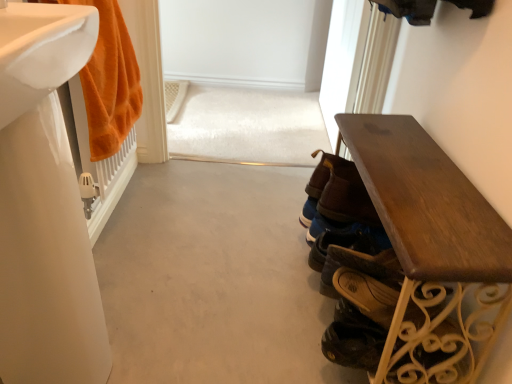
How much space does brown leather shoe at lower right, which is counted as the 1th shoe, starting from the top, occupy horizontally?

It is 18.76 centimeters.

Looking at this image, what is the approximate height of brown leather shoe at lower right, which is counted as the 1th shoe, starting from the top?

The height of brown leather shoe at lower right, which is counted as the 1th shoe, starting from the top, is 1.58 inches.

At what (x,y) coordinates should I click in order to perform the action: click on white glossy sink at left, which is the first sink in bottom-to-top order. Please return your answer as a coordinate pair (x, y). Looking at the image, I should click on (45, 205).

This screenshot has width=512, height=384. I want to click on shiny black shoe at lower right, which is counted as the second shoe, starting from the top, so click(354, 344).

Find the location of a particular element. The height and width of the screenshot is (384, 512). wooden bench at right is located at coordinates [433, 252].

Where is `brown leather shoe at lower right, marked as the second footwear in a back-to-front arrangement`? This screenshot has height=384, width=512. brown leather shoe at lower right, marked as the second footwear in a back-to-front arrangement is located at coordinates (360, 267).

Find the location of a particular element. white glossy sink at left, the 2th sink when ordered from bottom to top is located at coordinates (41, 52).

What is the approximate width of white glossy sink at left, the 2th sink when ordered from bottom to top?

8.75 inches.

At what (x,y) coordinates should I click in order to perform the action: click on brown leather shoe at lower right, which is counted as the 1th shoe, starting from the top. Please return your answer as a coordinate pair (x, y). Looking at the image, I should click on (367, 294).

How many degrees apart are the facing directions of shiny black shoe at lower right, which is counted as the second shoe, starting from the top, and white glossy sink at left, which is the second sink from top to bottom?

The angular difference between shiny black shoe at lower right, which is counted as the second shoe, starting from the top, and white glossy sink at left, which is the second sink from top to bottom, is 178 degrees.

Which point is more distant from viewer, (342, 356) or (61, 36)?

Point (342, 356)

Looking at their sizes, would you say shiny black shoe at lower right, which is counted as the second shoe, starting from the top, is wider or thinner than white glossy sink at left, which is the first sink in bottom-to-top order?

shiny black shoe at lower right, which is counted as the second shoe, starting from the top, is wider than white glossy sink at left, which is the first sink in bottom-to-top order.

Is shiny black shoe at lower right, which is counted as the second shoe, starting from the top, spatially inside white glossy sink at left, which is the first sink in bottom-to-top order, or outside of it?

The correct answer is: outside.

Is brown leather shoe at lower right, which is counted as the 1th shoe, starting from the top, situated inside wooden bench at right or outside?

The correct answer is: inside.

From the picture: Between brown leather shoe at lower right, which is counted as the 1th shoe, starting from the top, and wooden bench at right, which one has less height?

brown leather shoe at lower right, which is counted as the 1th shoe, starting from the top, is shorter.

Does brown leather shoe at lower right, which is counted as the 1th shoe, starting from the top, lie in front of wooden bench at right?

No.

Does brown leather shoe at lower right, which is counted as the 1th shoe, starting from the top, touch wooden bench at right?

No, brown leather shoe at lower right, which is counted as the 1th shoe, starting from the top, is not making contact with wooden bench at right.

Which is behind, point (338, 263) or point (114, 24)?

The point (114, 24) is behind.

From the image's perspective, which object appears higher, brown leather shoe at lower right, positioned as the 1th footwear in front-to-back order, or orange plush towel at left?

orange plush towel at left.

From a real-world perspective, which object stands above the other?

From a 3D spatial view, orange plush towel at left is above.

Does brown leather shoe at lower right, marked as the second footwear in a back-to-front arrangement, appear on the left side of orange plush towel at left?

No, brown leather shoe at lower right, marked as the second footwear in a back-to-front arrangement, is not to the left of orange plush towel at left.

Is white glossy sink at left, which is the first sink in bottom-to-top order, facing towards shiny black shoe at lower right, the first shoe when ordered from bottom to top?

Yes, white glossy sink at left, which is the first sink in bottom-to-top order, is turned towards shiny black shoe at lower right, the first shoe when ordered from bottom to top.

Is there a large distance between white glossy sink at left, which is the first sink in bottom-to-top order, and shiny black shoe at lower right, which is counted as the second shoe, starting from the top?

That's not correct — white glossy sink at left, which is the first sink in bottom-to-top order, is a little close to shiny black shoe at lower right, which is counted as the second shoe, starting from the top.

Locate an element on the screen. The height and width of the screenshot is (384, 512). the 1st shoe counting from the right of the white glossy sink at left, which is the first sink in bottom-to-top order is located at coordinates (354, 344).

How different are the orientations of white glossy sink at left, which is the second sink from top to bottom, and shiny black shoe at lower right, which is counted as the second shoe, starting from the top, in degrees?

The angular difference between white glossy sink at left, which is the second sink from top to bottom, and shiny black shoe at lower right, which is counted as the second shoe, starting from the top, is 178 degrees.

From the image's perspective, which one is positioned lower, white glossy sink at left, the 2th sink when ordered from bottom to top, or shiny black shoe at lower right, the first shoe when ordered from bottom to top?

From the image's view, shiny black shoe at lower right, the first shoe when ordered from bottom to top, is below.

Can you confirm if white glossy sink at left, the 2th sink when ordered from bottom to top, is bigger than shiny black shoe at lower right, which is counted as the second shoe, starting from the top?

Indeed, white glossy sink at left, the 2th sink when ordered from bottom to top, has a larger size compared to shiny black shoe at lower right, which is counted as the second shoe, starting from the top.

Based on the photo, is white glossy sink at left, which appears as the first sink when viewed from the top, not inside shiny black shoe at lower right, which is counted as the second shoe, starting from the top?

Yes.

Between white glossy sink at left, the 2th sink when ordered from bottom to top, and shiny black shoe at lower right, which is counted as the second shoe, starting from the top, which one has larger width?

With larger width is white glossy sink at left, the 2th sink when ordered from bottom to top.

From the picture: Is brown leather shoe at lower right, marked as the second footwear in a back-to-front arrangement, at the left side of white glossy sink at left, which is the second sink from top to bottom?

No, brown leather shoe at lower right, marked as the second footwear in a back-to-front arrangement, is not to the left of white glossy sink at left, which is the second sink from top to bottom.

Is brown leather shoe at lower right, positioned as the 1th footwear in front-to-back order, situated inside white glossy sink at left, which is the second sink from top to bottom, or outside?

The correct answer is: outside.

How different are the orientations of brown leather shoe at lower right, marked as the second footwear in a back-to-front arrangement, and white glossy sink at left, which is the first sink in bottom-to-top order, in degrees?

The facing directions of brown leather shoe at lower right, marked as the second footwear in a back-to-front arrangement, and white glossy sink at left, which is the first sink in bottom-to-top order, are 178 degrees apart.

Is point (384, 271) behind point (18, 149)?

Yes, point (384, 271) is behind point (18, 149).

From the image's perspective, between orange plush towel at left and brown leather shoe at lower right, which is counted as the 1th shoe, starting from the top, who is located below?

brown leather shoe at lower right, which is counted as the 1th shoe, starting from the top, from the image's perspective.

Considering the positions of objects orange plush towel at left and brown leather shoe at lower right, which is counted as the 1th shoe, starting from the top, in the image provided, who is more to the left, orange plush towel at left or brown leather shoe at lower right, which is counted as the 1th shoe, starting from the top,?

Positioned to the left is orange plush towel at left.

Looking at this image, choose the correct answer: Is orange plush towel at left inside brown leather shoe at lower right, which is counted as the 1th shoe, starting from the top, or outside it?

orange plush towel at left exists outside the volume of brown leather shoe at lower right, which is counted as the 1th shoe, starting from the top.

Is brown leather shoe at lower right, which is counted as the 1th shoe, starting from the top, at the back of orange plush towel at left?

No, orange plush towel at left is not facing the opposite direction of brown leather shoe at lower right, which is counted as the 1th shoe, starting from the top.

The image size is (512, 384). Identify the location of shoe that is the 2nd one below the white glossy sink at left, which is the first sink in bottom-to-top order (from a real-world perspective). (354, 344).

The width and height of the screenshot is (512, 384). What are the coordinates of `furniture located above the brown leather shoe at lower right, which is counted as the 1th shoe, starting from the top (from the image's perspective)` in the screenshot? It's located at (433, 252).

Considering their positions, is wooden bench at right positioned closer to brown leather shoe at lower right, the 2th shoe positioned from the bottom, than white glossy sink at left, which is the first sink in bottom-to-top order?

Among the two, wooden bench at right is located nearer to brown leather shoe at lower right, the 2th shoe positioned from the bottom.

From the image, which object appears to be farther from brown leather shoes at center, the first footwear viewed from the back, orange plush towel at left or white glossy sink at left, which appears as the first sink when viewed from the top?

white glossy sink at left, which appears as the first sink when viewed from the top, lies further to brown leather shoes at center, the first footwear viewed from the back, than the other object.

When comparing their distances from brown leather shoe at lower right, which is counted as the 1th shoe, starting from the top, does white glossy sink at left, which is the first sink in bottom-to-top order, or brown leather shoes at center, the first footwear viewed from the back, seem further?

white glossy sink at left, which is the first sink in bottom-to-top order, is further to brown leather shoe at lower right, which is counted as the 1th shoe, starting from the top.

Based on their spatial positions, is brown leather shoes at center, the first footwear viewed from the back, or white glossy sink at left, which is the first sink in bottom-to-top order, closer to orange plush towel at left?

white glossy sink at left, which is the first sink in bottom-to-top order, is positioned closer to the anchor orange plush towel at left.

Based on their spatial positions, is white glossy sink at left, which appears as the first sink when viewed from the top, or brown leather shoe at lower right, marked as the second footwear in a back-to-front arrangement, further from brown leather shoes at center, acting as the second footwear starting from the front?

white glossy sink at left, which appears as the first sink when viewed from the top, lies further to brown leather shoes at center, acting as the second footwear starting from the front, than the other object.

Based on their spatial positions, is white glossy sink at left, which is the second sink from top to bottom, or brown leather shoes at center, the first footwear viewed from the back, further from orange plush towel at left?

Based on the image, brown leather shoes at center, the first footwear viewed from the back, appears to be further to orange plush towel at left.

Estimate the real-world distances between objects in this image. Which object is further from brown leather shoe at lower right, positioned as the 1th footwear in front-to-back order, white glossy sink at left, which is the first sink in bottom-to-top order, or brown leather shoes at center, the first footwear viewed from the back?

Based on the image, white glossy sink at left, which is the first sink in bottom-to-top order, appears to be further to brown leather shoe at lower right, positioned as the 1th footwear in front-to-back order.

Which object lies further to the anchor point white glossy sink at left, the 2th sink when ordered from bottom to top, white glossy sink at left, which is the first sink in bottom-to-top order, or brown leather shoe at lower right, which is counted as the 1th shoe, starting from the top?

Based on the image, brown leather shoe at lower right, which is counted as the 1th shoe, starting from the top, appears to be further to white glossy sink at left, the 2th sink when ordered from bottom to top.

Where is `footwear between white glossy sink at left, the 2th sink when ordered from bottom to top, and brown leather shoes at center, the first footwear viewed from the back, from front to back`? The width and height of the screenshot is (512, 384). footwear between white glossy sink at left, the 2th sink when ordered from bottom to top, and brown leather shoes at center, the first footwear viewed from the back, from front to back is located at coordinates (360, 267).

Locate an element on the screen. The height and width of the screenshot is (384, 512). shoe positioned between shiny black shoe at lower right, which is counted as the second shoe, starting from the top, and brown leather shoes at center, acting as the second footwear starting from the front, from near to far is located at coordinates (367, 294).

Locate an element on the screen. The image size is (512, 384). shoe situated between white glossy sink at left, which is the second sink from top to bottom, and brown leather shoes at center, the first footwear viewed from the back, from left to right is located at coordinates (354, 344).

Locate an element on the screen. footwear located between shiny black shoe at lower right, which is counted as the second shoe, starting from the top, and brown leather shoes at center, acting as the second footwear starting from the front, in the depth direction is located at coordinates (360, 267).